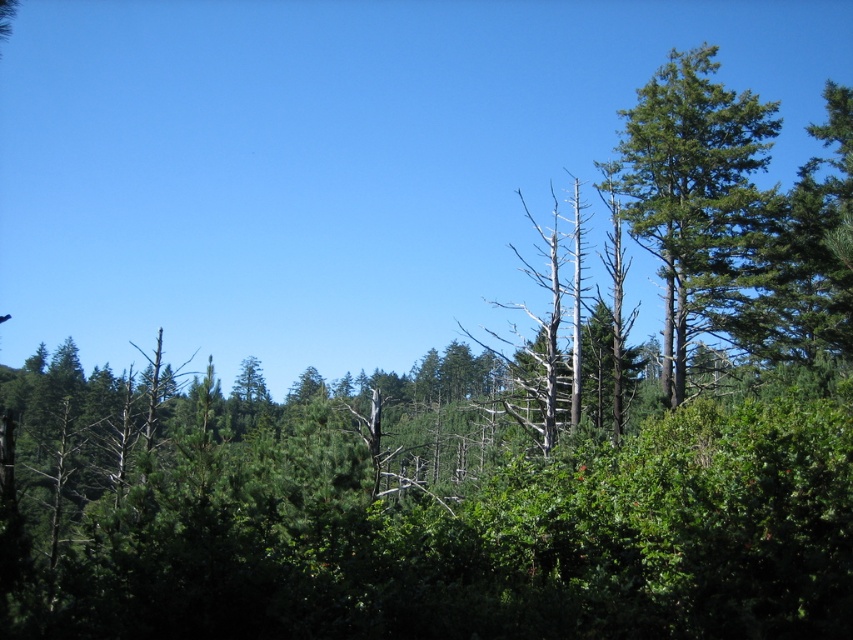
From the picture: Measure the distance between point (672, 193) and camera.

Point (672, 193) and camera are 36.04 meters apart.

Between green textured tree at right and dead wood tree at center, which one appears on the right side from the viewer's perspective?

From the viewer's perspective, green textured tree at right appears more on the right side.

Between point (724, 278) and point (540, 317), which one is positioned behind?

The point (540, 317) is more distant.

What are the coordinates of `green textured tree at right` in the screenshot? It's located at (692, 189).